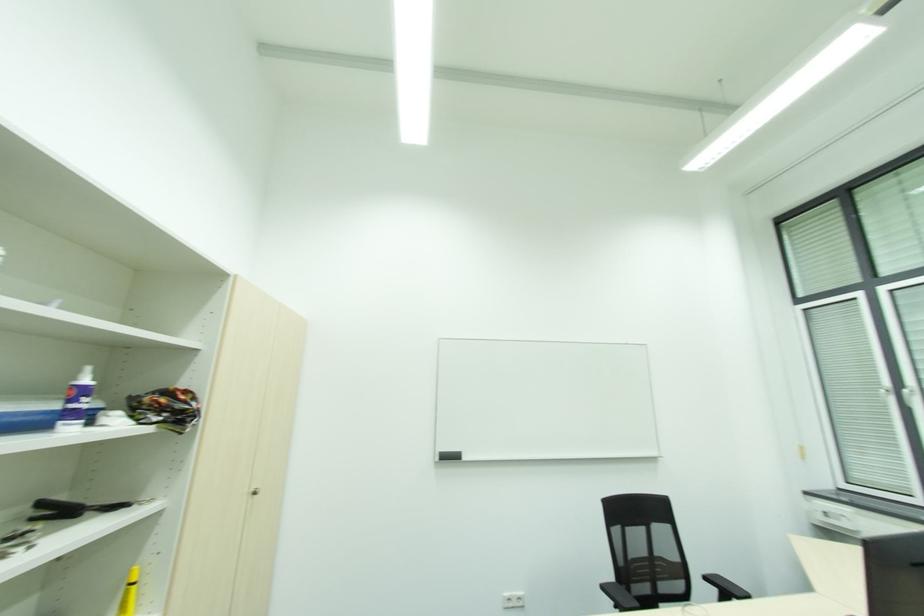
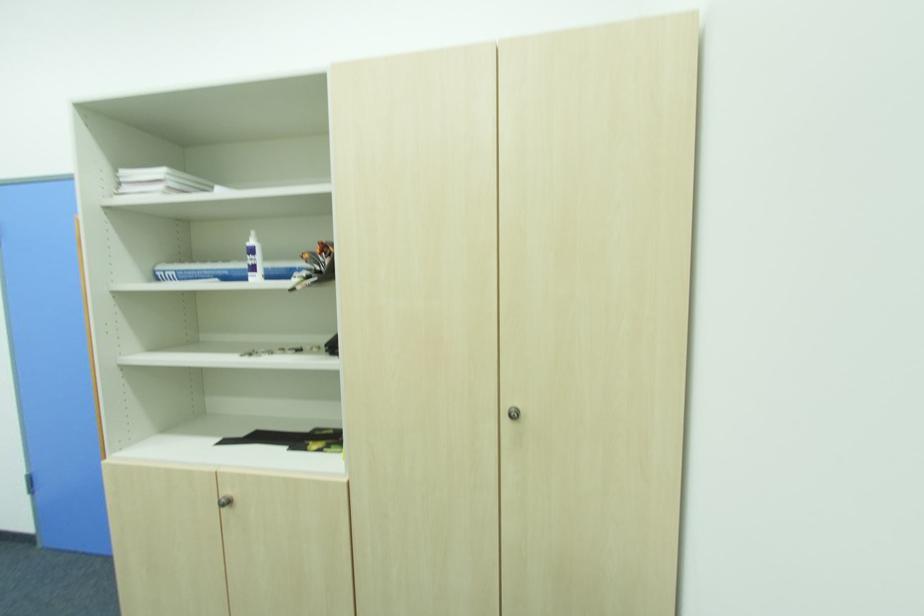
Where in the second image is the point corresponding to pixel 89 381 from the first image?

(254, 243)